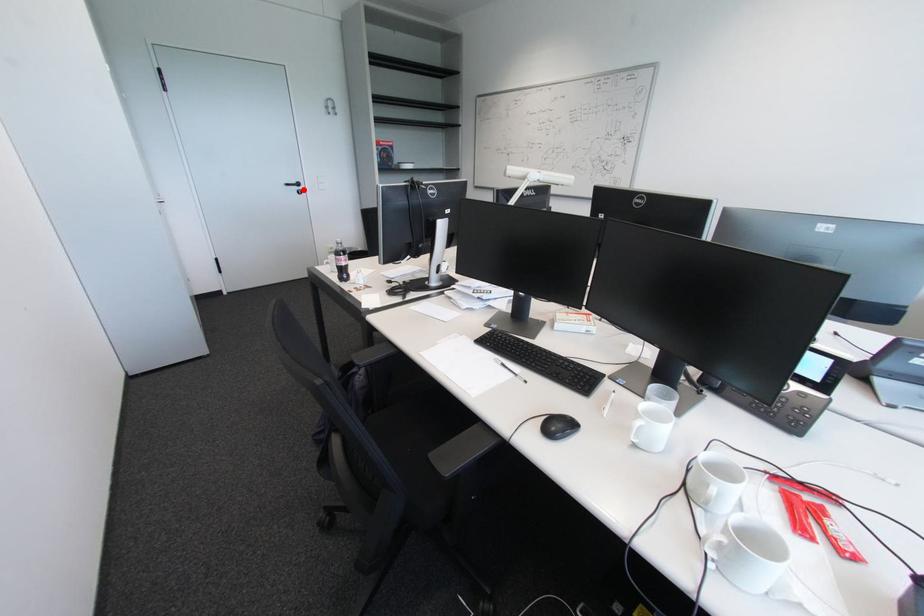
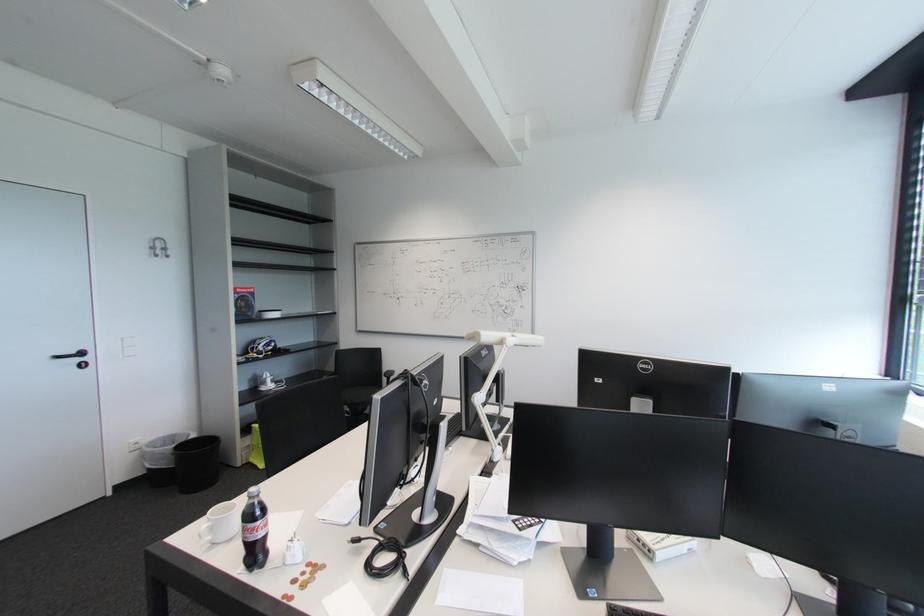
Locate, in the second image, the point that corresponds to the highlighted location in the first image.

(83, 361)